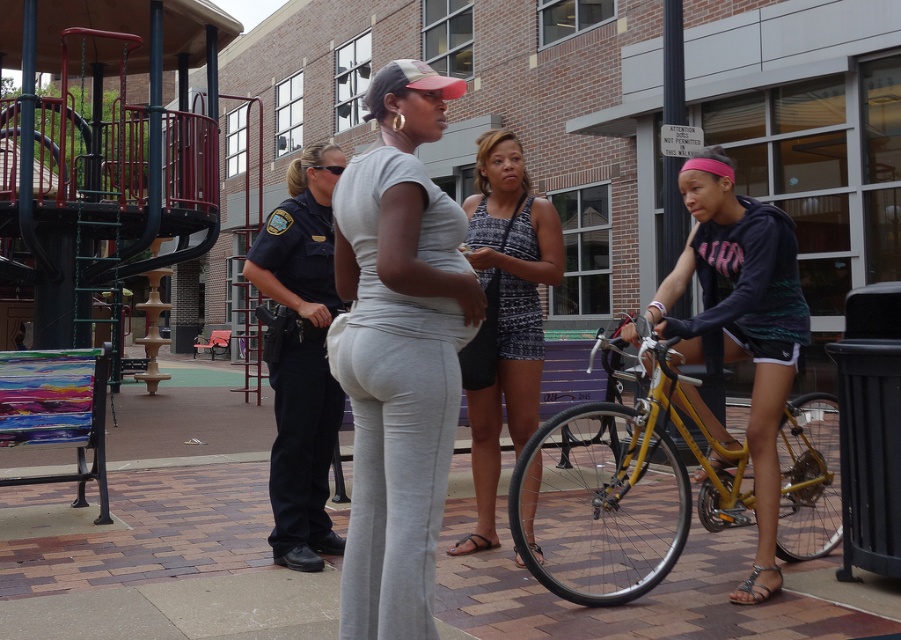
Question: Can you confirm if dark blue jersey at center is thinner than printed fabric tank top at center?

Choices:
 (A) yes
 (B) no

Answer: (B)

Question: Which object appears farthest from the camera in this image?

Choices:
 (A) printed fabric tank top at center
 (B) brick pavement at center
 (C) dark blue jersey at center

Answer: (A)

Question: Considering the relative positions of dark blue uniform at left and printed fabric tank top at center in the image provided, where is dark blue uniform at left located with respect to printed fabric tank top at center?

Choices:
 (A) right
 (B) left

Answer: (B)

Question: Is yellow metallic bicycle at right above dark blue jersey at center?

Choices:
 (A) no
 (B) yes

Answer: (A)

Question: Which of the following is the closest to the observer?

Choices:
 (A) printed fabric tank top at center
 (B) dark blue jersey at center
 (C) brick pavement at center

Answer: (C)

Question: Estimate the real-world distances between objects in this image. Which object is farther from the dark blue uniform at left?

Choices:
 (A) dark blue jersey at center
 (B) yellow metallic bicycle at right

Answer: (B)